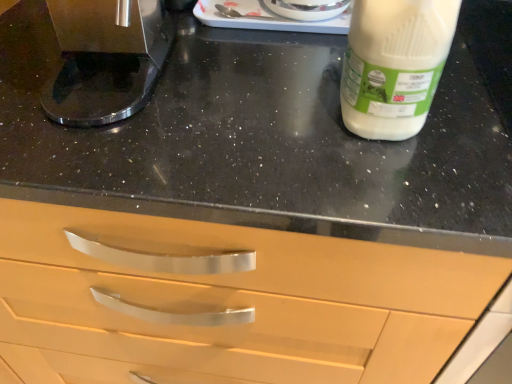
Where is `free space to the right of white plastic bottle at upper right`? This screenshot has width=512, height=384. free space to the right of white plastic bottle at upper right is located at coordinates (470, 103).